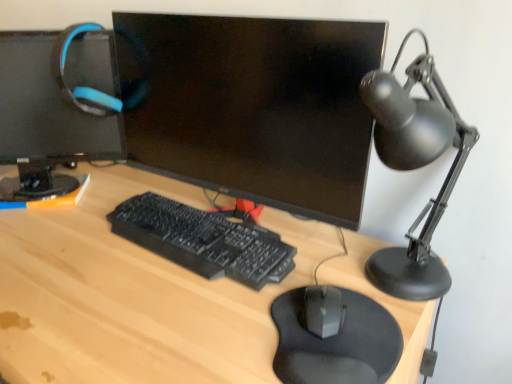
Identify the location of free space below matte black monitor at center, acting as the 2th computer monitor starting from the left (from a real-world perspective). pyautogui.click(x=276, y=228).